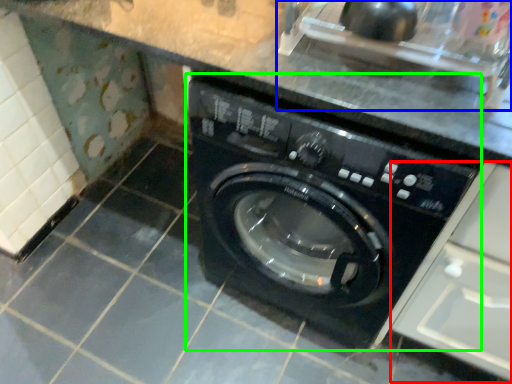
Question: Which is nearer to the drawer (highlighted by a red box)? sink (highlighted by a blue box) or washing machine (highlighted by a green box).

Choices:
 (A) sink
 (B) washing machine

Answer: (B)